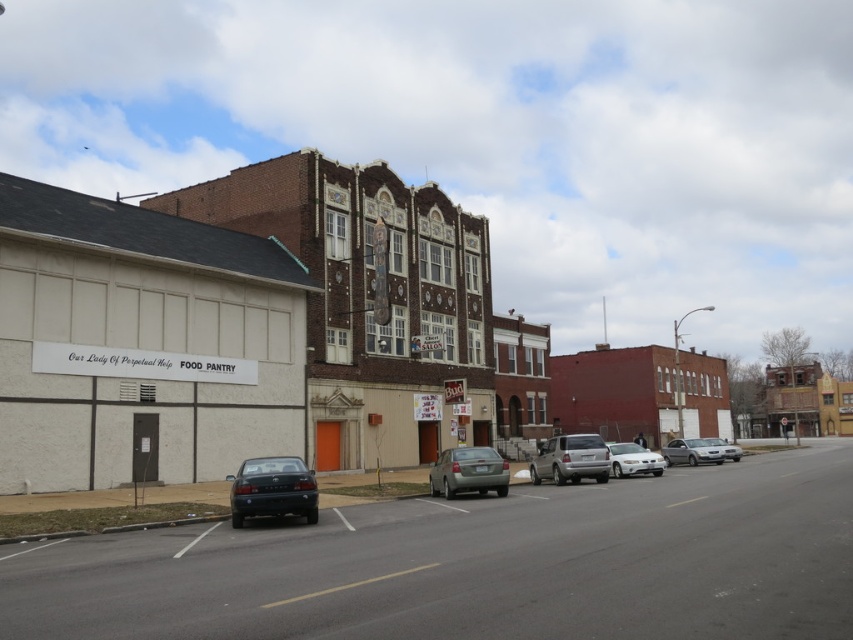
Is matte black sedan at lower left positioned at the back of silver metallic suv at center?

That is False.

What do you see at coordinates (273, 490) in the screenshot? I see `matte black sedan at lower left` at bounding box center [273, 490].

Find the location of a particular element. The width and height of the screenshot is (853, 640). matte black sedan at lower left is located at coordinates (273, 490).

Which of these two, metallic silver sedan at center or white glossy sedan at center, stands shorter?

Standing shorter between the two is metallic silver sedan at center.

Who is higher up, metallic silver sedan at center or white glossy sedan at center?

Positioned higher is metallic silver sedan at center.

Between point (503, 481) and point (641, 468), which one is positioned behind?

The point (641, 468) is behind.

The width and height of the screenshot is (853, 640). I want to click on metallic silver sedan at center, so click(x=468, y=472).

Is matte black sedan at lower left shorter than silver metallic sedan at center-right?

Yes, matte black sedan at lower left is shorter than silver metallic sedan at center-right.

Identify the location of matte black sedan at lower left. (273, 490).

The image size is (853, 640). Find the location of `matte black sedan at lower left`. matte black sedan at lower left is located at coordinates click(x=273, y=490).